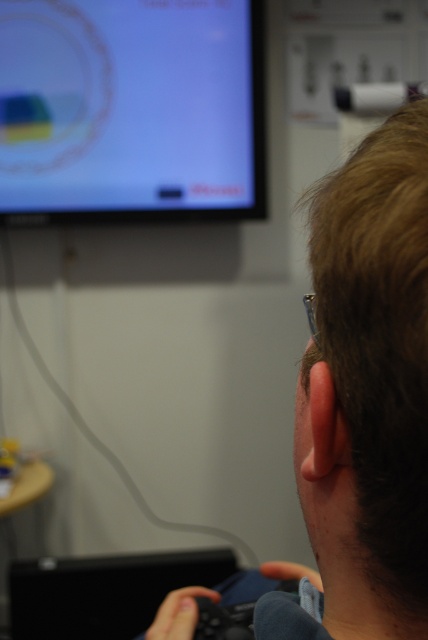
You are a photographer taking a picture of the scene. The matte plastic monitor at upper left and the brown hair at upper right are both in the frame. Which object is closer to the camera?

The brown hair at upper right is behind the matte plastic monitor at upper left, so the matte plastic monitor at upper left is closer to the camera.

You are a game developer observing the scene. You need to adjust the camera angle to focus on the brown hair at upper right without moving the matte plastic monitor at upper left. Is this possible given their current positions?

The matte plastic monitor at upper left is positioned over brown hair at upper right, so adjusting the camera angle to focus on the brown hair at upper right without moving the monitor might be challenging as the monitor currently blocks the direct line of sight to the hair.

You are a game developer observing a player in a testing session. You notice the matte plastic monitor at upper left and the brown hair at upper right. Which object takes up more visual space in the scene?

The matte plastic monitor at upper left takes up more visual space in the scene because it has a larger size compared to the brown hair at upper right.